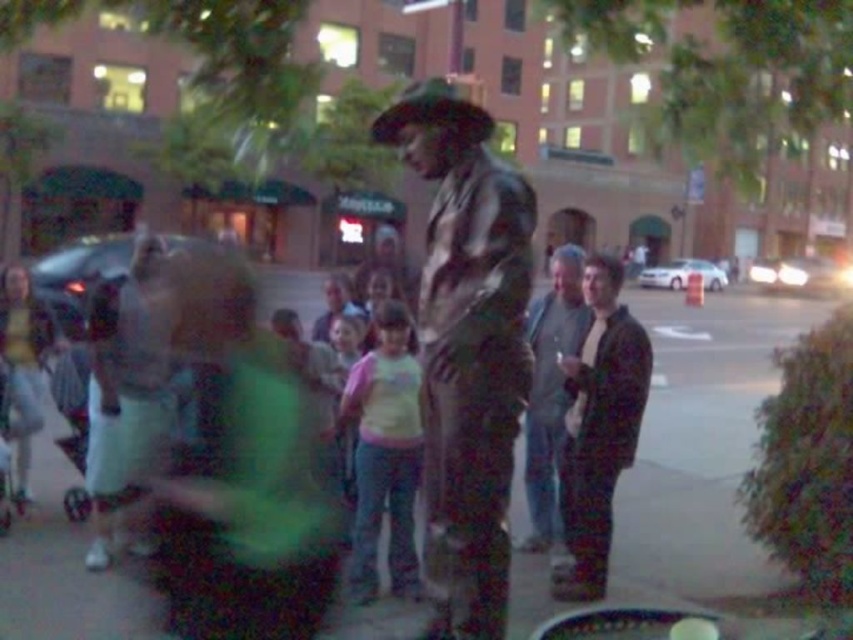
You are a tailor who needs to determine which item requires more fabric for a custom order. You see the green fabric at center and the shiny brown leather jacket at center in the scene. Which item has a greater width?

The green fabric at center has a greater width than the shiny brown leather jacket at center.

You are a street performer who needs to adjust your costume. You have a gray fabric jacket at center and a green fabric at center. Which one is closer to the audience?

The green fabric at center is closer to the audience because the gray fabric jacket at center is behind it.

Looking at this image, you are a street performer standing at the center of the scene. You need to pass a prop from the green fabric at center to the gray fabric jacket at center. Can you do it without moving from your spot?

The distance between the green fabric at center and the gray fabric jacket at center is 32.48 feet, so you cannot pass the prop without moving from your spot since it is too far.